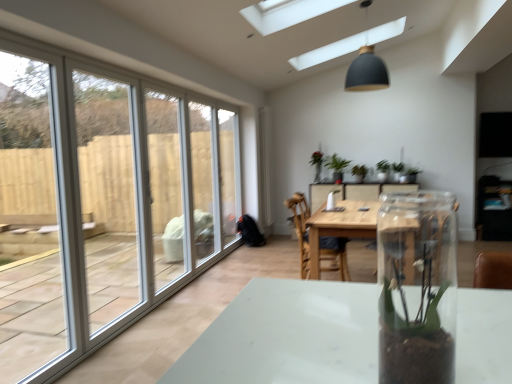
Question: In which direction should I rotate to look at green matte plant at center, which appears as the first houseplant when viewed from the left?

Choices:
 (A) left
 (B) right

Answer: (B)

Question: From a real-world perspective, is wooden chair at center beneath wooden table at center?

Choices:
 (A) yes
 (B) no

Answer: (B)

Question: From the image's perspective, is wooden chair at center above wooden table at center?

Choices:
 (A) yes
 (B) no

Answer: (A)

Question: Are wooden chair at center and wooden table at center located far from each other?

Choices:
 (A) yes
 (B) no

Answer: (B)

Question: Is wooden chair at center surrounding wooden table at center?

Choices:
 (A) yes
 (B) no

Answer: (B)

Question: Is wooden chair at center smaller than wooden table at center?

Choices:
 (A) no
 (B) yes

Answer: (B)

Question: Considering the relative sizes of wooden chair at center and wooden table at center in the image provided, is wooden chair at center thinner than wooden table at center?

Choices:
 (A) no
 (B) yes

Answer: (B)

Question: Is white plastic screen door at left, placed as the 2th screen door when sorted from back to front, at the right side of wooden chair at center?

Choices:
 (A) no
 (B) yes

Answer: (A)

Question: Is white plastic screen door at left, placed as the 1th screen door when sorted from front to back, thinner than wooden chair at center?

Choices:
 (A) yes
 (B) no

Answer: (A)

Question: Considering the relative sizes of white plastic screen door at left, placed as the 1th screen door when sorted from front to back, and wooden chair at center in the image provided, is white plastic screen door at left, placed as the 1th screen door when sorted from front to back, taller than wooden chair at center?

Choices:
 (A) yes
 (B) no

Answer: (A)

Question: Is white plastic screen door at left, placed as the 2th screen door when sorted from back to front, surrounding wooden chair at center?

Choices:
 (A) no
 (B) yes

Answer: (A)

Question: Is white plastic screen door at left, placed as the 1th screen door when sorted from front to back, located outside wooden chair at center?

Choices:
 (A) yes
 (B) no

Answer: (A)

Question: Can you confirm if white plastic screen door at left, placed as the 1th screen door when sorted from front to back, is wider than wooden chair at center?

Choices:
 (A) yes
 (B) no

Answer: (B)

Question: Does wooden table at center come in front of green matte plant at center, arranged as the second houseplant when viewed from the right?

Choices:
 (A) no
 (B) yes

Answer: (B)